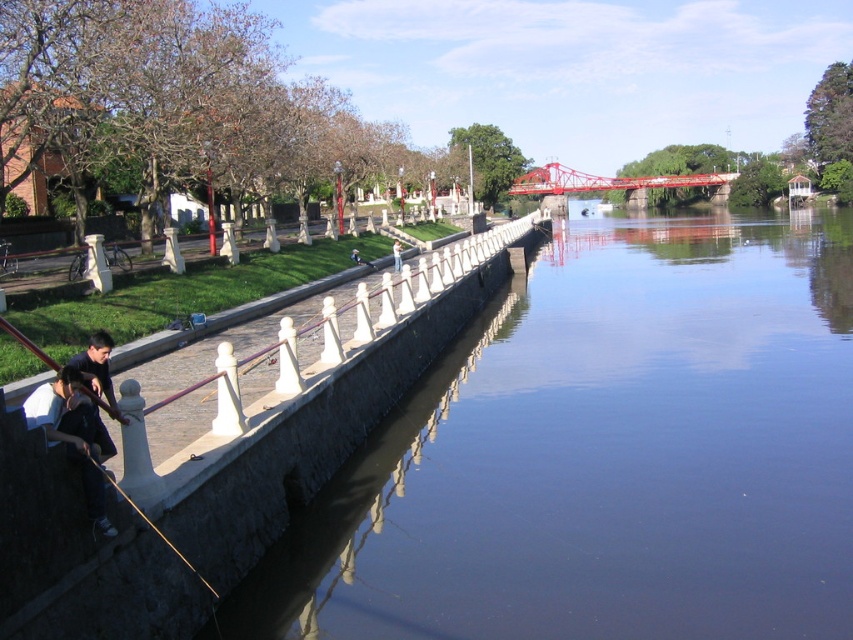
You are standing on the paved walkway and want to place a small statue exactly halfway between the smooth concrete water at center and the light brown wooden pole at center. Which object will the statue be closer to?

The statue will be closer to the light brown wooden pole at center because the smooth concrete water at center is taller than the light brown wooden pole at center, making the distance between them shorter near the pole.

You are standing on the embankment and want to place a small decorative statue on the smooth concrete water at center and the dark blue fabric at lower left. Which surface would allow the statue to be seen from a lower viewpoint without obstruction?

The smooth concrete water at center has a greater height compared to dark blue fabric at lower left, so placing the statue on the smooth concrete water at center would make it more visible from a lower viewpoint as it sits higher.